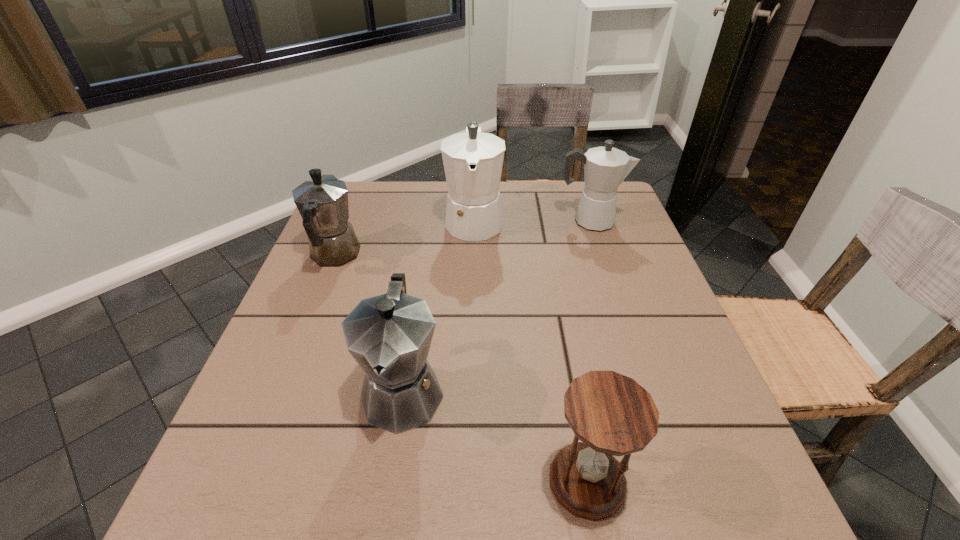
You are a GUI agent. You are given a task and a screenshot of the screen. Output one action in this format:
    pyautogui.click(x=<x>, y=<y>)
    Task: Click on the free region located on the pouring side of the leftmost object
    The image size is (960, 540).
    Given the screenshot: What is the action you would take?
    pyautogui.click(x=351, y=213)

At what (x,y) coordinates should I click in order to perform the action: click on free space located on the pouring side of the leftmost object. Please return your answer as a coordinate pair (x, y). The width and height of the screenshot is (960, 540). Looking at the image, I should click on (356, 202).

Locate an element on the screen. This screenshot has width=960, height=540. free point located on the back of the hourglass is located at coordinates (557, 316).

This screenshot has height=540, width=960. Find the location of `object that is at the near edge`. object that is at the near edge is located at coordinates click(611, 414).

What are the coordinates of `object that is at the left edge` in the screenshot? It's located at (322, 202).

Where is `object situated at the right edge`? object situated at the right edge is located at coordinates (605, 168).

The height and width of the screenshot is (540, 960). I want to click on object present at the far right corner, so click(x=605, y=168).

This screenshot has height=540, width=960. What are the coordinates of `free region at the far edge` in the screenshot? It's located at (390, 218).

Find the location of `vacant space at the near edge of the desktop`. vacant space at the near edge of the desktop is located at coordinates (609, 526).

Find the location of a particular element. The image size is (960, 540). vacant region at the left edge of the desktop is located at coordinates (228, 475).